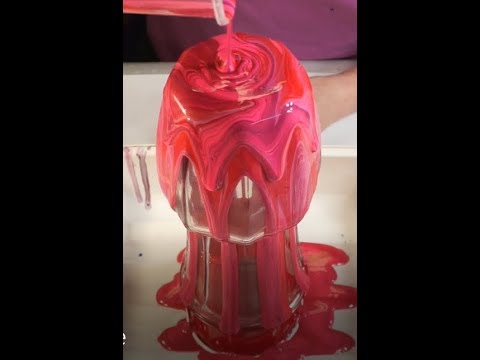
Image resolution: width=480 pixels, height=360 pixels. What are the coordinates of `goo on table` in the screenshot? It's located at (324, 274).